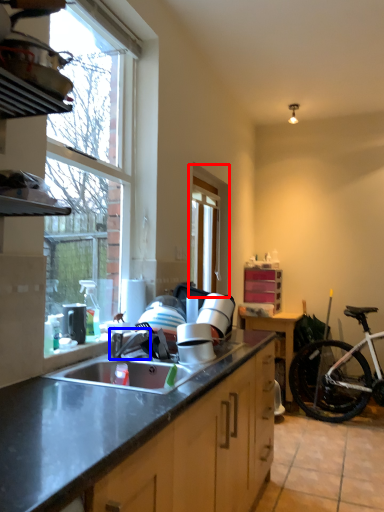
Question: Among these objects, which one is farthest to the camera, window (highlighted by a red box) or faucet (highlighted by a blue box)?

Choices:
 (A) window
 (B) faucet

Answer: (A)